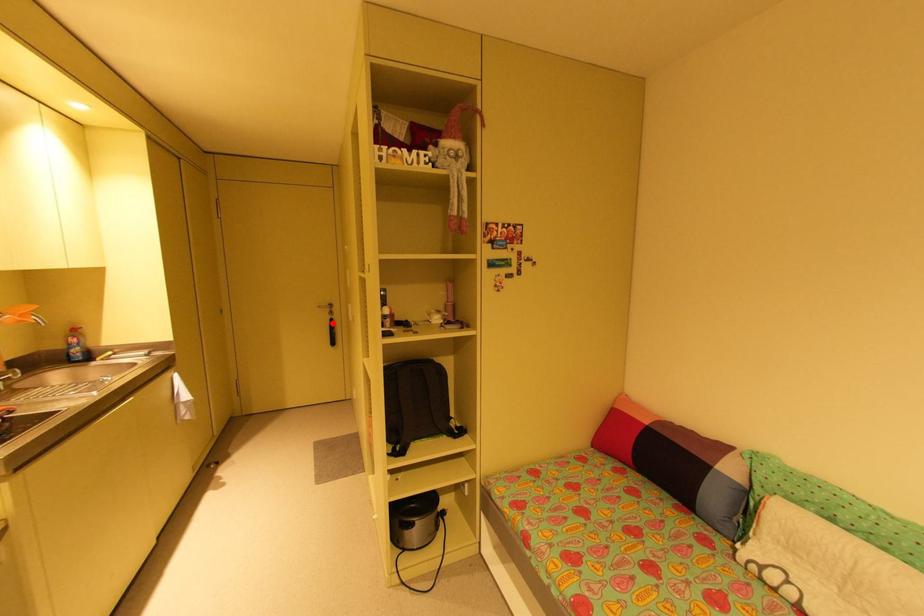
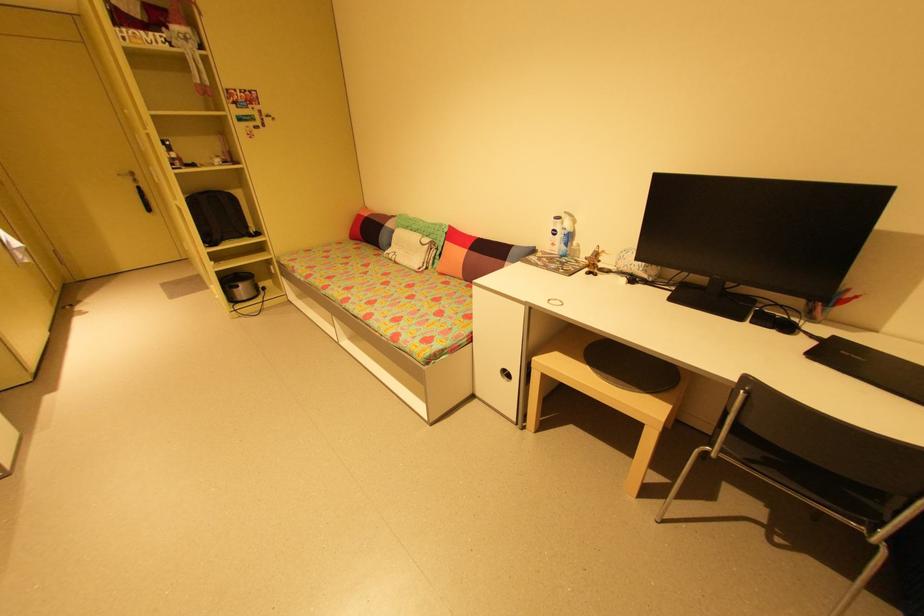
Where in the second image is the point corresponding to the highlighted location from the first image?

(140, 191)